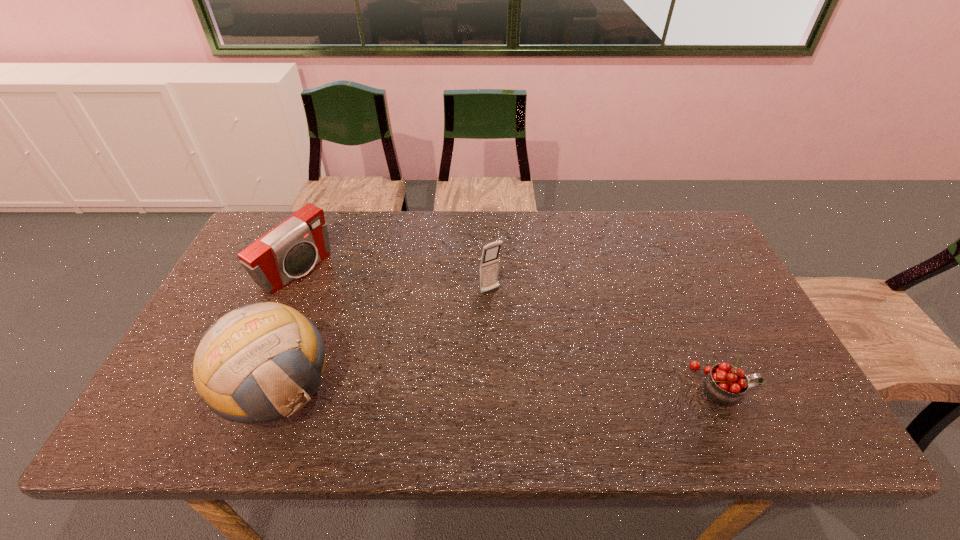
Where is `volleyball`? The width and height of the screenshot is (960, 540). volleyball is located at coordinates (261, 362).

At what (x,y) coordinates should I click in order to perform the action: click on pot filled with cherries. Please return your answer as a coordinate pair (x, y). This screenshot has width=960, height=540. Looking at the image, I should click on tap(725, 384).

You are a GUI agent. You are given a task and a screenshot of the screen. Output one action in this format:
    pyautogui.click(x=<x>, y=<y>)
    Task: Click on the shortest object
    The height and width of the screenshot is (540, 960).
    Given the screenshot: What is the action you would take?
    pyautogui.click(x=725, y=384)

Locate an element on the screen. cellular telephone is located at coordinates (489, 261).

Identify the location of camera. (290, 250).

The image size is (960, 540). I want to click on vacant space located 0.050m on the back of the tallest object, so click(x=301, y=330).

At what (x,y) coordinates should I click in order to perform the action: click on vacant region located on the handle side of the pot filled with cherries. Please return your answer as a coordinate pair (x, y). This screenshot has width=960, height=540. Looking at the image, I should click on (778, 386).

The height and width of the screenshot is (540, 960). Identify the location of vacant area situated 0.050m on the front-facing side of the cellular telephone. (503, 308).

Identify the location of free space located on the front-facing side of the cellular telephone. This screenshot has height=540, width=960. (547, 368).

At what (x,y) coordinates should I click in order to perform the action: click on vacant space situated on the front-facing side of the cellular telephone. Please return your answer as a coordinate pair (x, y). This screenshot has height=540, width=960. Looking at the image, I should click on (552, 374).